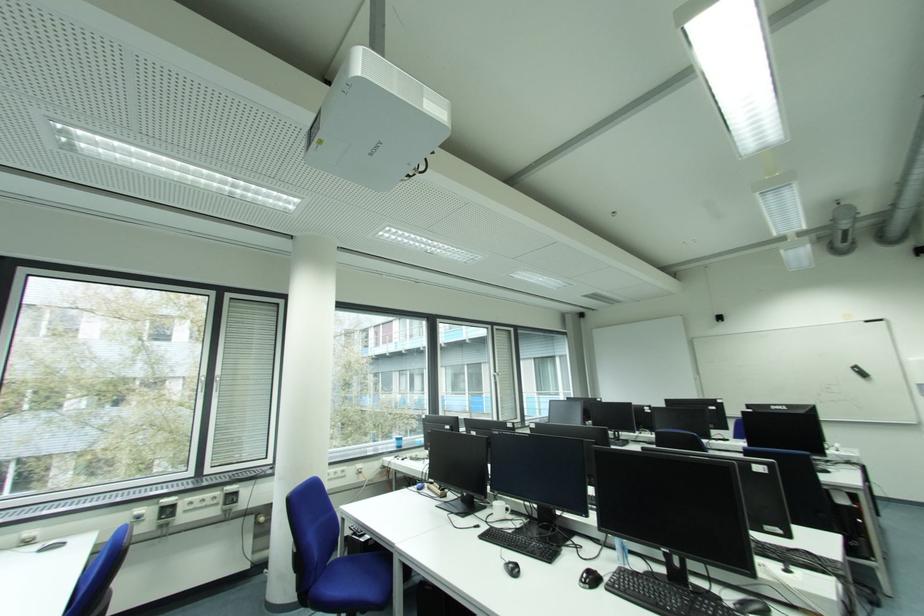
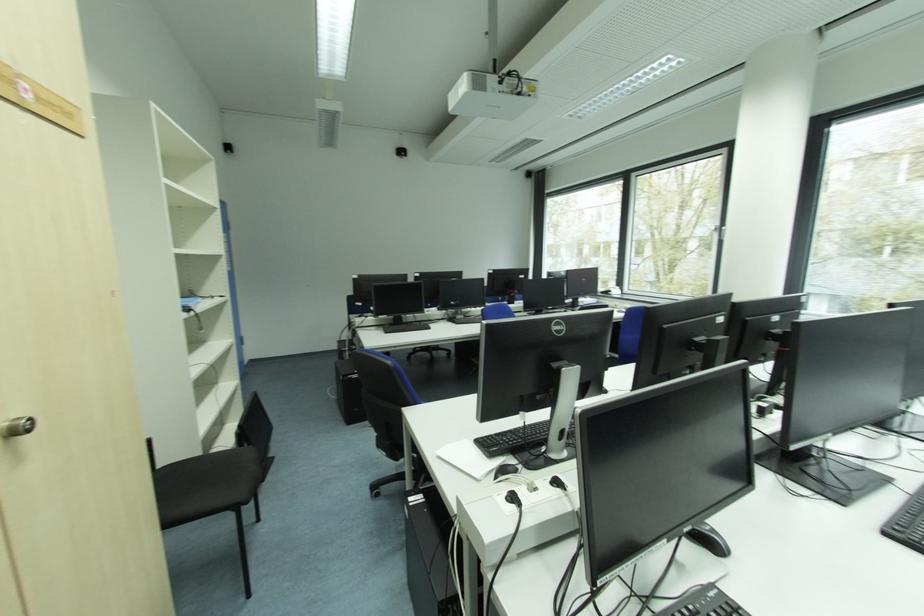
Question: I am providing you with two images of the same scene from different viewpoints. After the viewpoint changes to image2, which objects are now occluded?

Choices:
 (A) chair sitting surface
 (B) white plastic bin
 (C) white mug handle
 (D) metal door handle

Answer: (C)